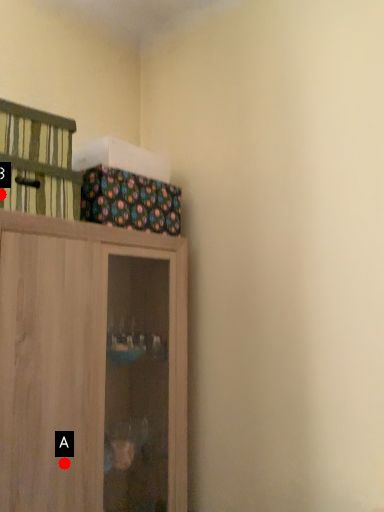
Question: Two points are circled on the image, labeled by A and B beside each circle. Which point is closer to the camera?

Choices:
 (A) A is closer
 (B) B is closer

Answer: (B)